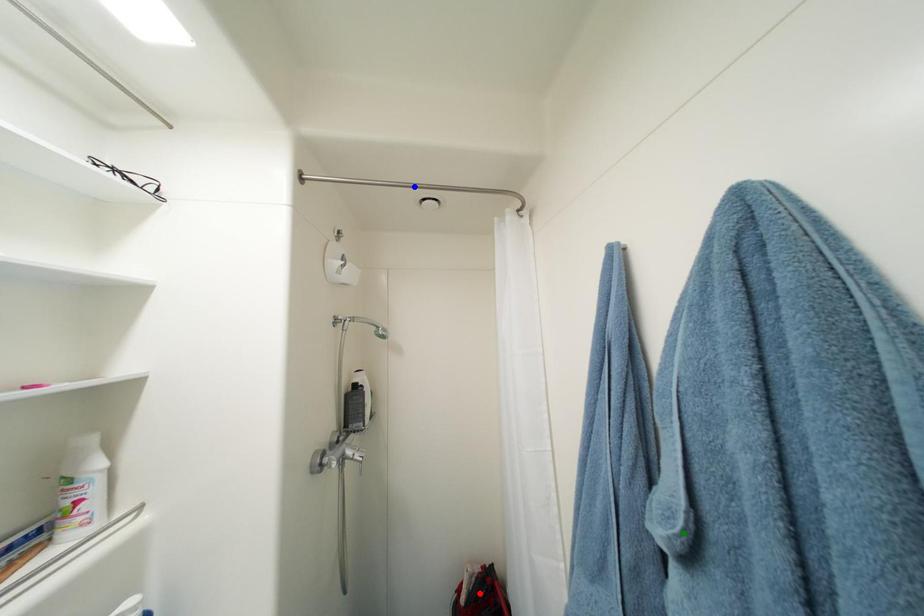
Order these from farthest to nearest:
blue point, red point, green point

red point < blue point < green point